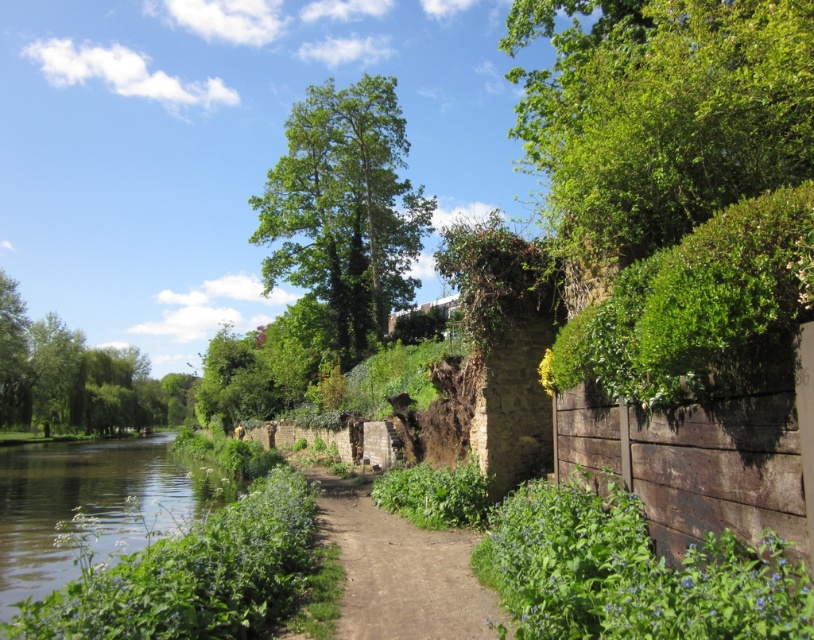
Between point (535, 102) and point (125, 419), which one is positioned behind?

Point (125, 419)

Does point (546, 32) come farther from viewer compared to point (136, 385)?

No, it is in front of (136, 385).

At what (x,y) coordinates should I click in order to perform the action: click on green leafy tree at upper right. Please return your answer as a coordinate pair (x, y). Looking at the image, I should click on (661, 113).

Does green leafy hedge at upper right have a lesser width compared to green grassy river at lower left?

Correct, green leafy hedge at upper right's width is less than green grassy river at lower left's.

Which is in front, point (697, 385) or point (63, 442)?

Point (697, 385) is in front.

Is point (683, 362) less distant than point (55, 536)?

That is True.

The height and width of the screenshot is (640, 814). I want to click on green leafy hedge at upper right, so (x=699, y=308).

Between green grassy river at lower left and dirt path at center, which one has more height?

Standing taller between the two is green grassy river at lower left.

Can you confirm if green grassy river at lower left is positioned below dirt path at center?

Yes, green grassy river at lower left is below dirt path at center.

Find the location of a particular element. The image size is (814, 640). green grassy river at lower left is located at coordinates (93, 506).